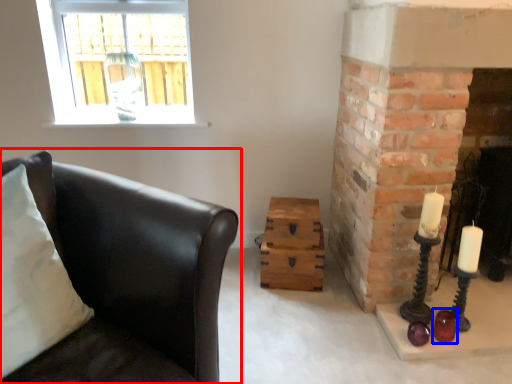
Question: Which object is further to the camera taking this photo, studio couch (highlighted by a red box) or candle holder (highlighted by a blue box)?

Choices:
 (A) studio couch
 (B) candle holder

Answer: (B)